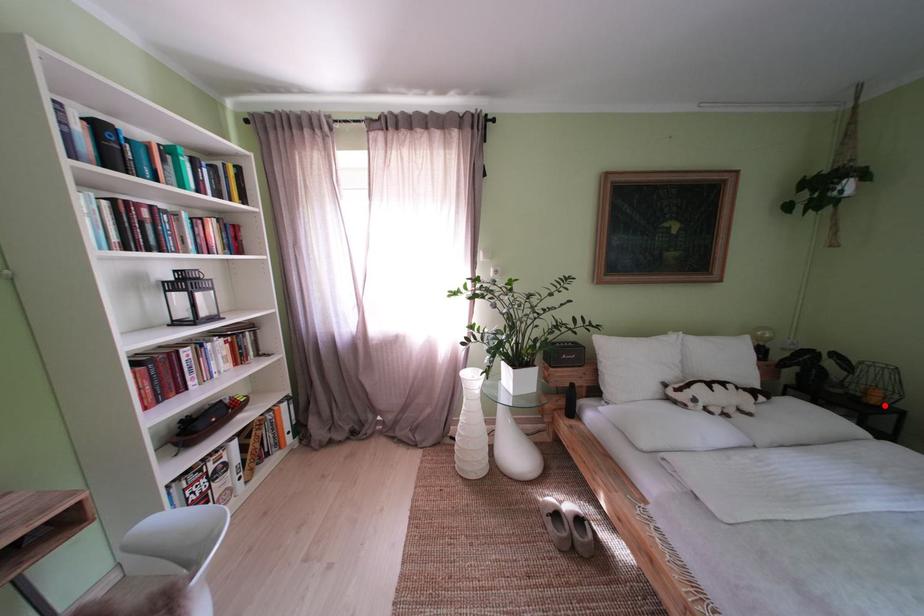
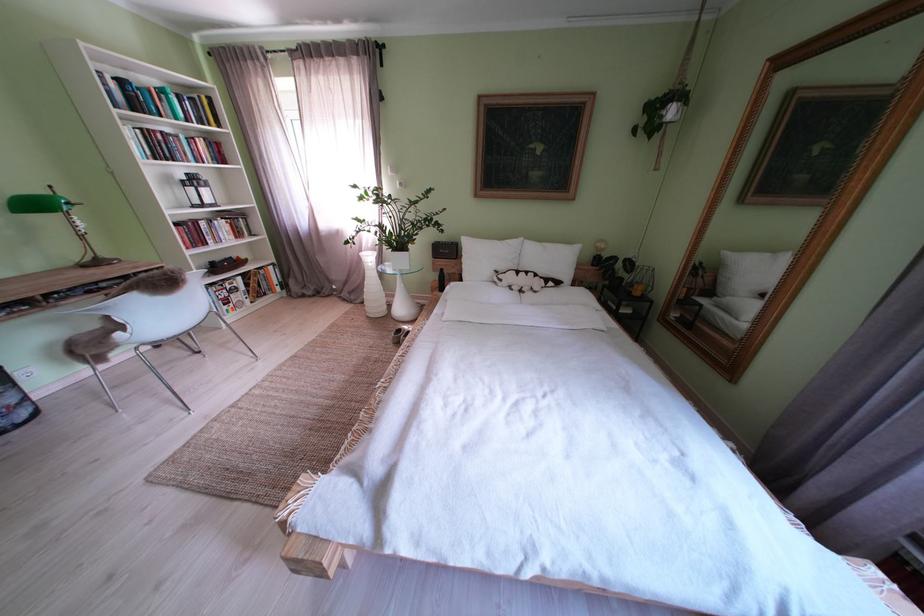
The point at the highlighted location is marked in the first image. Where is the corresponding point in the second image?

(648, 299)